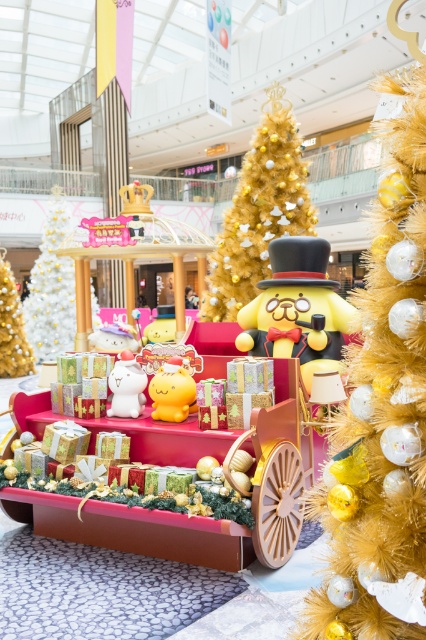
Question: Which of the following is the closest to the observer?

Choices:
 (A) white plush cat at center
 (B) gold glittering christmas tree at left

Answer: (A)

Question: Which point is closer to the camera?

Choices:
 (A) (126, 362)
 (B) (310, 244)
 (C) (181, 394)

Answer: (C)

Question: From the image, what is the correct spatial relationship of yellow matte bear at center in relation to yellow matte plush cat at center?

Choices:
 (A) above
 (B) below

Answer: (A)

Question: Among these points, which one is farthest from the camera?

Choices:
 (A) (252, 241)
 (B) (36, 346)

Answer: (B)

Question: Is gold textured christmas tree at center thinner than gold glittering christmas tree at left?

Choices:
 (A) yes
 (B) no

Answer: (A)

Question: Does white matte christmas tree at center lie behind yellow matte plush cat at center?

Choices:
 (A) yes
 (B) no

Answer: (A)